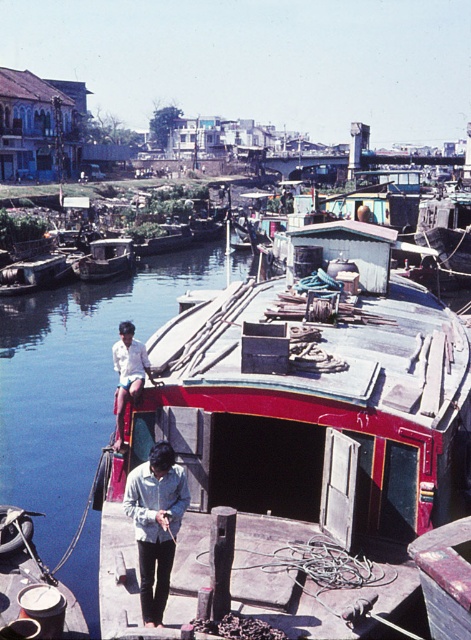
Question: In this image, where is red painted wood boat at center located relative to white cotton shirt at upper left?

Choices:
 (A) right
 (B) left

Answer: (A)

Question: Among these points, which one is farthest from the camera?

Choices:
 (A) tap(27, 515)
 (B) tap(456, 324)
 (C) tap(121, 440)

Answer: (B)

Question: Estimate the real-world distances between objects in this image. Which object is closer to the red painted wood boat at center?

Choices:
 (A) metallic gray boat at center
 (B) white cotton shirt at upper left

Answer: (A)

Question: Which object appears farthest from the camera in this image?

Choices:
 (A) light blue denim shirt at center
 (B) white cotton shirt at upper left
 (C) metallic gray boat at center

Answer: (B)

Question: Is metallic gray boat at center bigger than white cotton shirt at upper left?

Choices:
 (A) yes
 (B) no

Answer: (A)

Question: Can you confirm if light blue denim shirt at center is bigger than white cotton shirt at upper left?

Choices:
 (A) yes
 (B) no

Answer: (A)